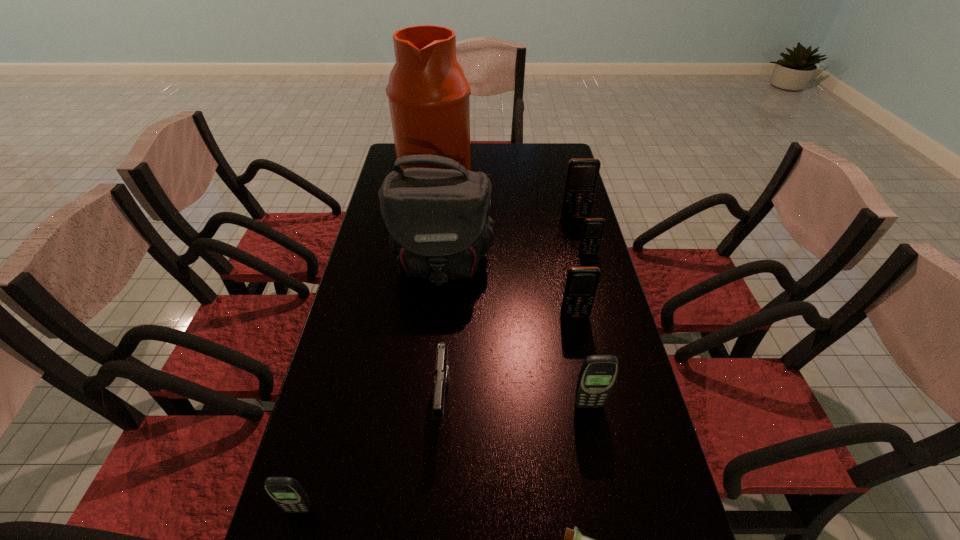
At what (x,y) coordinates should I click in order to perform the action: click on free space located 0.290m on the screen of the second farthest orange cellular telephone. Please return your answer as a coordinate pair (x, y). Looking at the image, I should click on (608, 326).

Identify the location of free region located 0.120m aim along the barrel of the pistol. Image resolution: width=960 pixels, height=540 pixels. (438, 497).

Find the location of `object that is at the far edge`. object that is at the far edge is located at coordinates (428, 93).

Where is `water jug present at the left edge`? The width and height of the screenshot is (960, 540). water jug present at the left edge is located at coordinates (428, 93).

Locate an element on the screen. shoulder bag present at the left edge is located at coordinates (437, 221).

Where is `cellular telephone that is positioned at the left edge`? This screenshot has height=540, width=960. cellular telephone that is positioned at the left edge is located at coordinates (286, 492).

The width and height of the screenshot is (960, 540). What are the coordinates of `object present at the far left corner` in the screenshot? It's located at (428, 93).

In the image, there is a desktop. At what (x,y) coordinates should I click in order to perform the action: click on vacant space at the far edge. Please return your answer as a coordinate pair (x, y). This screenshot has height=540, width=960. Looking at the image, I should click on (520, 160).

The image size is (960, 540). In order to click on vacant region at the left edge in this screenshot , I will do `click(364, 353)`.

The width and height of the screenshot is (960, 540). I want to click on vacant space at the right edge, so click(x=560, y=247).